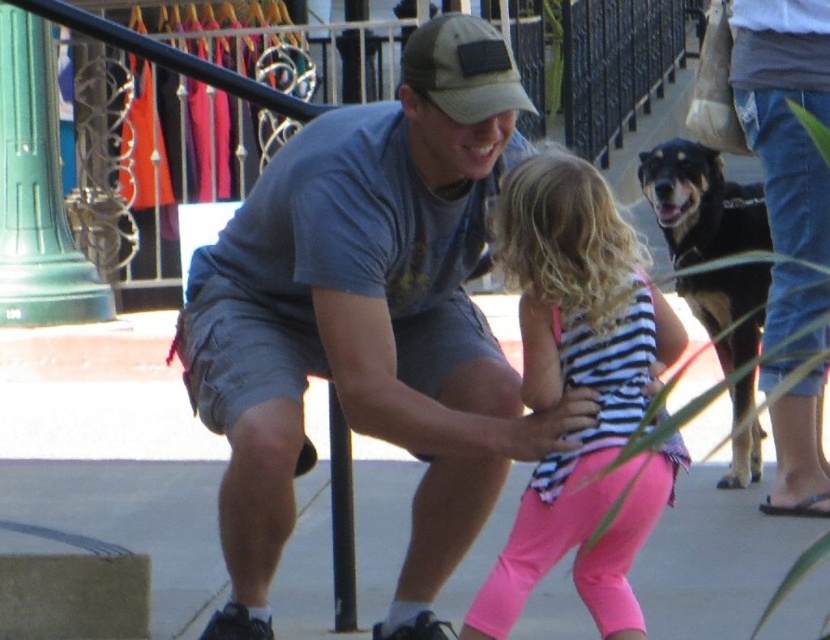
Question: Which of the following is the farthest from the observer?

Choices:
 (A) (442, 86)
 (B) (443, 77)
 (C) (814, 150)

Answer: (C)

Question: Can you confirm if denim jeans at right is positioned below camouflage fabric baseball cap at center?

Choices:
 (A) no
 (B) yes

Answer: (B)

Question: Which point appears farthest from the camera in this image?

Choices:
 (A) (745, 122)
 (B) (658, 296)
 (C) (232, 410)

Answer: (A)

Question: Does denim jeans at right appear on the right side of camouflage fabric baseball cap at center?

Choices:
 (A) yes
 (B) no

Answer: (A)

Question: Estimate the real-world distances between objects in this image. Which object is closer to the striped fabric shirt at center?

Choices:
 (A) denim jeans at right
 (B) gray cotton t-shirt at center
 (C) black fur dog at right
 (D) camouflage fabric baseball cap at center

Answer: (B)

Question: Is gray cotton t-shirt at center wider than striped fabric shirt at center?

Choices:
 (A) no
 (B) yes

Answer: (B)